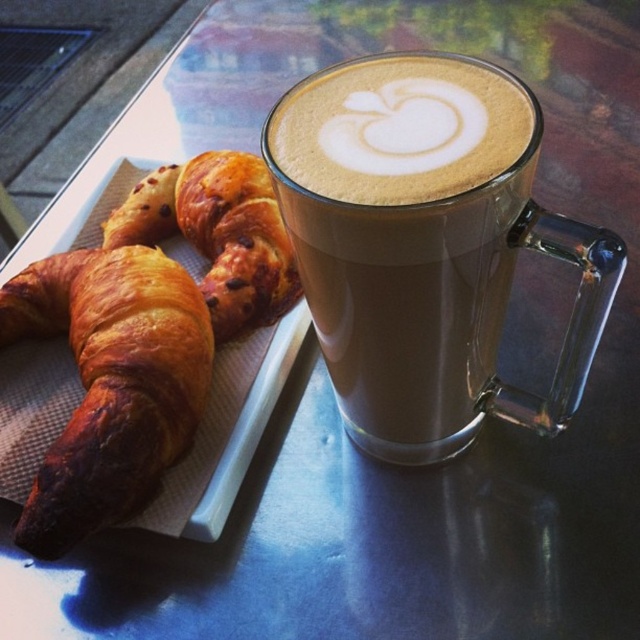
Question: Which of the following is the farthest from the observer?

Choices:
 (A) brown frothy latte art at upper center
 (B) golden-brown flaky croissant at left

Answer: (B)

Question: Estimate the real-world distances between objects in this image. Which object is farther from the golden brown flaky croissant at left?

Choices:
 (A) brown frothy latte at center
 (B) golden-brown flaky croissant at left
 (C) brown frothy latte art at upper center

Answer: (C)

Question: Does golden-brown flaky croissant at left appear on the left side of golden brown flaky croissant at left?

Choices:
 (A) no
 (B) yes

Answer: (B)

Question: Is brown frothy latte art at upper center thinner than golden brown flaky croissant at left?

Choices:
 (A) no
 (B) yes

Answer: (B)

Question: Which object is closer to the camera taking this photo?

Choices:
 (A) brown frothy latte art at upper center
 (B) brown frothy latte at center
 (C) golden-brown flaky croissant at left
 (D) golden brown flaky croissant at left

Answer: (B)

Question: Observing the image, what is the correct spatial positioning of golden-brown flaky croissant at left in reference to brown frothy latte art at upper center?

Choices:
 (A) left
 (B) right

Answer: (A)